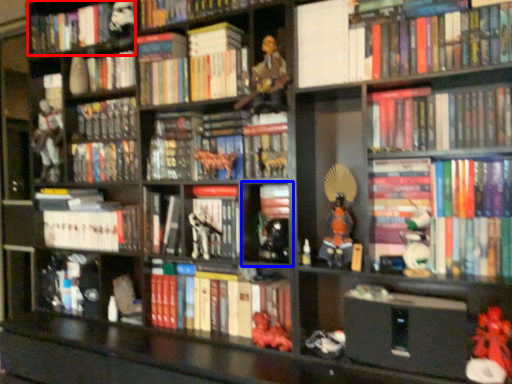
Question: Among these objects, which one is farthest to the camera, book (highlighted by a red box) or cabinet (highlighted by a blue box)?

Choices:
 (A) book
 (B) cabinet

Answer: (A)